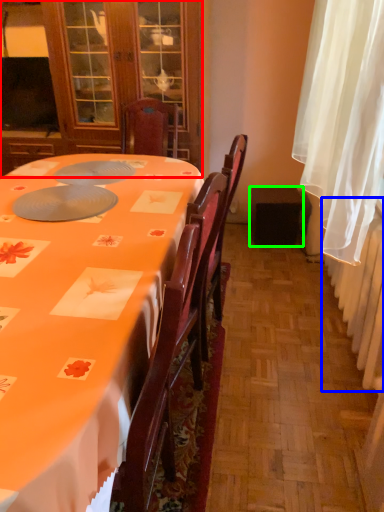
Question: Considering the real-world distances, which object is farthest from cabinetry (highlighted by a red box)? radiator (highlighted by a blue box) or loudspeaker (highlighted by a green box)?

Choices:
 (A) radiator
 (B) loudspeaker

Answer: (A)